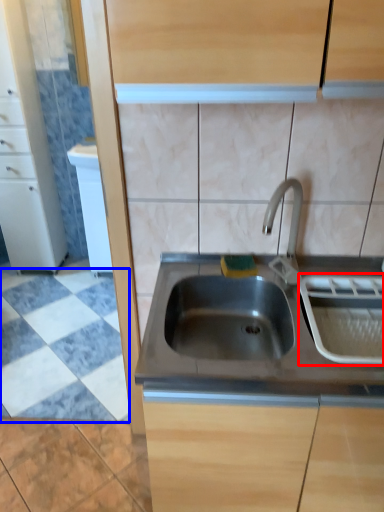
Question: Among these objects, which one is nearest to the camera, appliance (highlighted by a red box) or ceramic tile (highlighted by a blue box)?

Choices:
 (A) appliance
 (B) ceramic tile

Answer: (A)